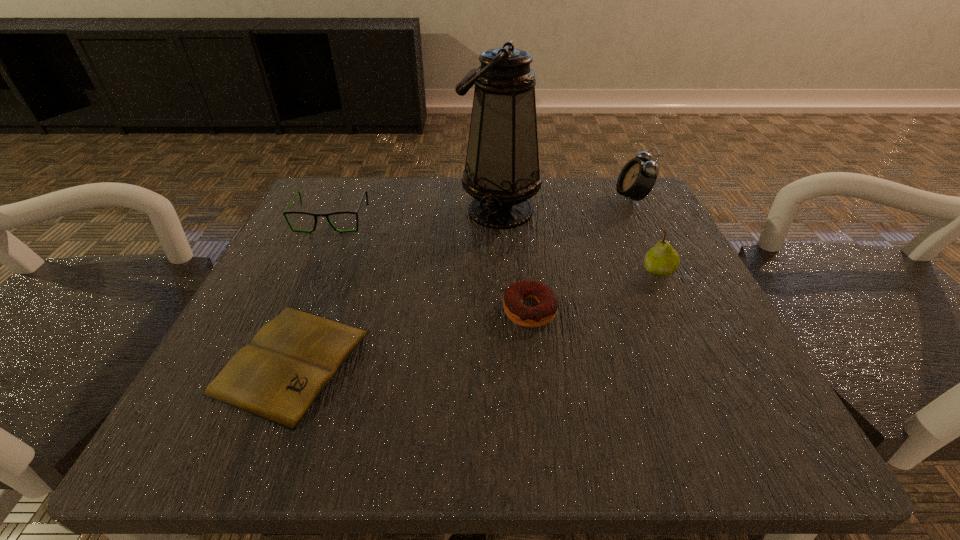
Image resolution: width=960 pixels, height=540 pixels. What are the coordinates of `vacant area at the far right corner of the desktop` in the screenshot? It's located at (659, 219).

I want to click on free region at the near right corner of the desktop, so click(707, 404).

Locate an element on the screen. free point between the spectacles and the tallest object is located at coordinates (416, 215).

Image resolution: width=960 pixels, height=540 pixels. I want to click on vacant space that is in between the oil lamp and the book, so click(396, 286).

Find the location of `free space between the fifth shortest object and the doughnut`. free space between the fifth shortest object and the doughnut is located at coordinates (581, 254).

Locate an element on the screen. This screenshot has height=540, width=960. vacant space that is in between the third tallest object and the doughnut is located at coordinates (594, 291).

At what (x,y) coordinates should I click in order to perform the action: click on empty space that is in between the doughnut and the book. Please return your answer as a coordinate pair (x, y). The height and width of the screenshot is (540, 960). Looking at the image, I should click on (411, 336).

The height and width of the screenshot is (540, 960). What are the coordinates of `vacant area between the third shortest object and the shortest object` in the screenshot? It's located at (311, 291).

At what (x,y) coordinates should I click in order to perform the action: click on free space between the doughnut and the shortest object. Please return your answer as a coordinate pair (x, y). Image resolution: width=960 pixels, height=540 pixels. Looking at the image, I should click on 411,336.

Identify the location of vacant point located between the spectacles and the book. (311, 291).